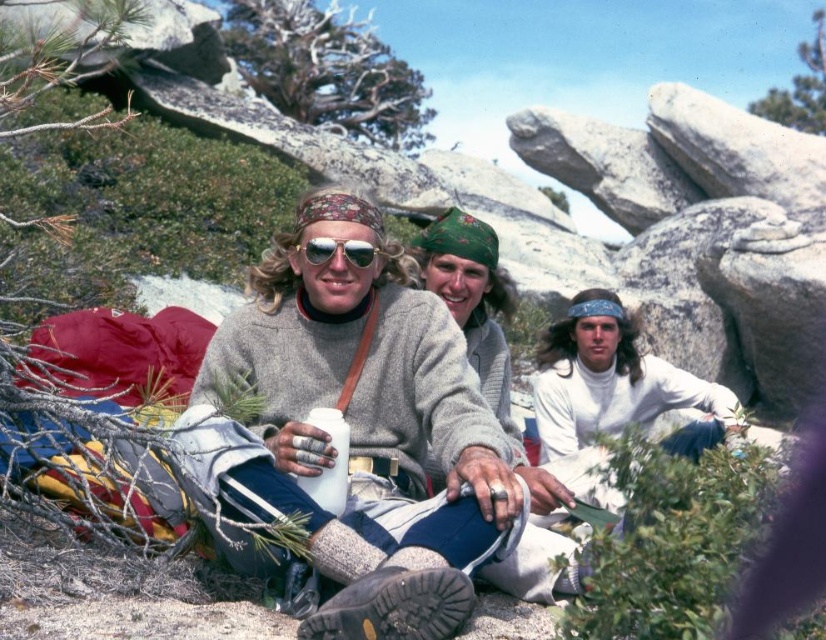
Between point (302, 413) and point (724, 400), which one is positioned behind?

Point (724, 400)

Is point (499, 481) positioned in front of point (596, 320)?

Yes, it is.

The height and width of the screenshot is (640, 826). What are the coordinates of `knit sweater at center` in the screenshot? It's located at (368, 433).

Does white matte turtleneck at center appear on the right side of matte silver goggles at center?

Correct, you'll find white matte turtleneck at center to the right of matte silver goggles at center.

Does point (629, 396) come closer to viewer compared to point (309, 248)?

No.

Identify the location of white matte turtleneck at center. (616, 384).

Measure the distance between knit sweater at center and camera.

knit sweater at center and camera are 4.56 meters apart.

Measure the distance from knit sweater at center to matte silver goggles at center.

knit sweater at center and matte silver goggles at center are 27.52 inches apart from each other.

Which is in front, point (369, 342) or point (363, 253)?

Point (363, 253)

Where is `knit sweater at center`? The width and height of the screenshot is (826, 640). knit sweater at center is located at coordinates (368, 433).